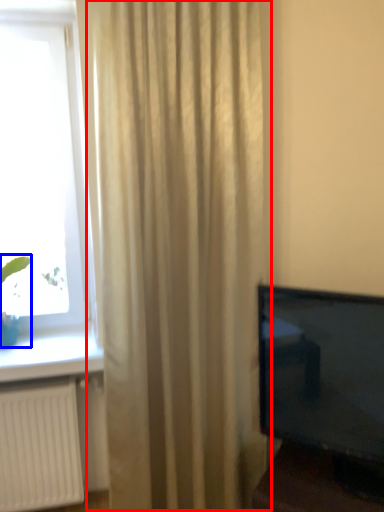
Question: Which point is closer to the camera, curtain (highlighted by a red box) or plant (highlighted by a blue box)?

Choices:
 (A) curtain
 (B) plant

Answer: (A)